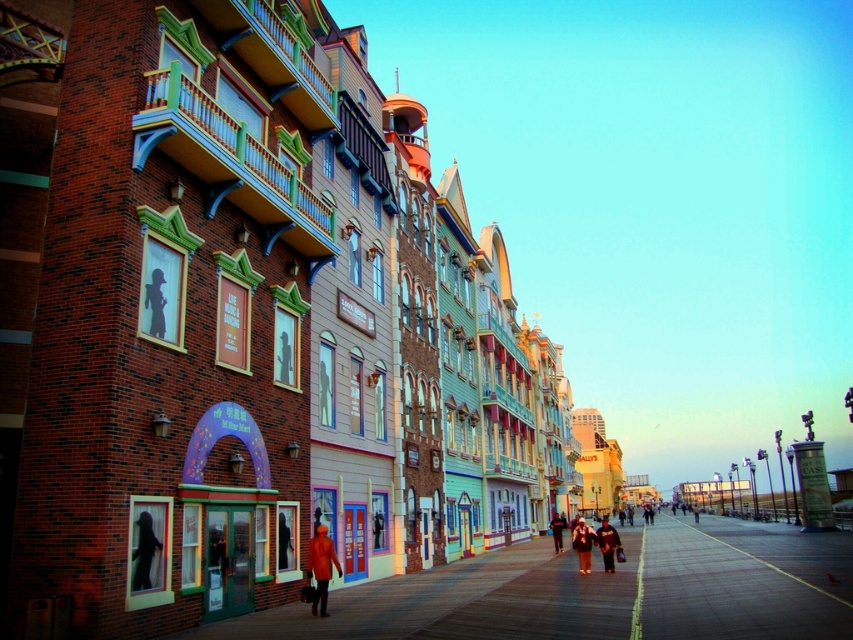
Question: Which point is farther to the camera?

Choices:
 (A) (370, 589)
 (B) (322, 525)
 (C) (611, 568)
 (D) (152, 540)

Answer: (C)

Question: Does orange fabric coat at center appear on the left side of orange fabric jacket at center?

Choices:
 (A) no
 (B) yes

Answer: (B)

Question: From the image, what is the correct spatial relationship of wooden boardwalk at center in relation to orange fabric coat at center?

Choices:
 (A) below
 (B) above

Answer: (A)

Question: Based on their relative distances, which object is nearer to the orange fabric coat at center?

Choices:
 (A) orange matte coat at center
 (B) silhouette figure at center
 (C) orange jacket at center
 (D) orange fabric jacket at center

Answer: (D)

Question: Is wooden boardwalk at center to the left of silhouette figure at center from the viewer's perspective?

Choices:
 (A) no
 (B) yes

Answer: (A)

Question: Among these objects, which one is nearest to the camera?

Choices:
 (A) silhouette figure at center
 (B) orange fabric coat at center
 (C) wooden boardwalk at center
 (D) orange jacket at center

Answer: (C)